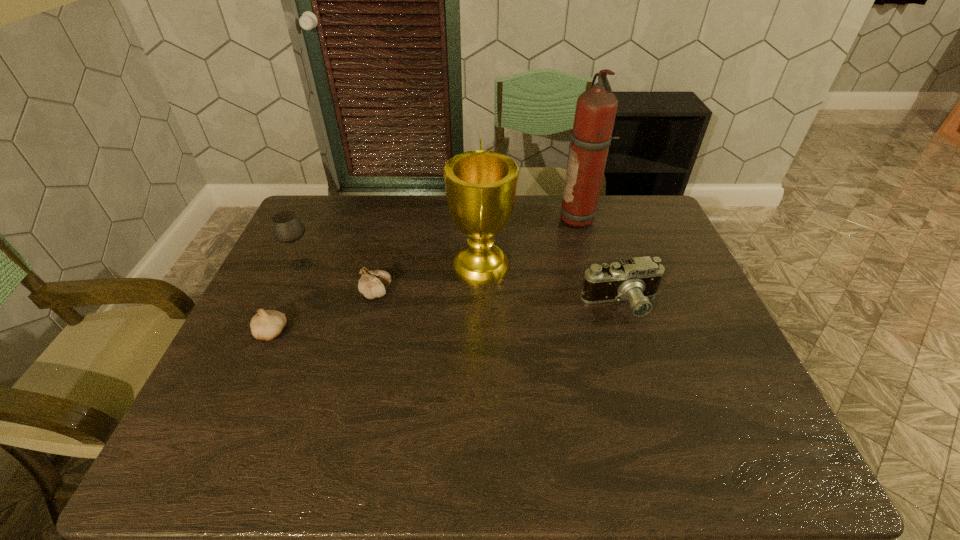
Select which object is the third closest to the wineglass. Please provide its 2D coordinates. Your answer should be formatted as a tuple, i.e. [(x, y)], where the tuple contains the x and y coordinates of a point satisfying the conditions above.

[(480, 185)]

Locate an element on the screen. This screenshot has height=540, width=960. blank area in the image that satisfies the following two spatial constraints: 1. on the front side of the farther garlic; 2. on the left side of the wineglass is located at coordinates (289, 293).

This screenshot has height=540, width=960. Identify the location of free space that satisfies the following two spatial constraints: 1. on the side of the tallest object with the label and nozzle; 2. on the front side of the third tallest object. (593, 265).